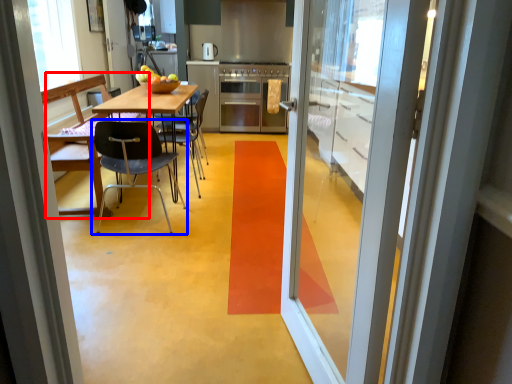
Question: Which point is closer to the camera, chair (highlighted by a red box) or chair (highlighted by a blue box)?

Choices:
 (A) chair
 (B) chair

Answer: (B)